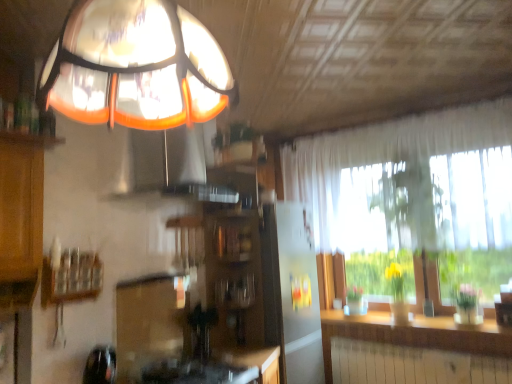
This screenshot has width=512, height=384. What are the coordinates of `wooden shelf at left` in the screenshot? It's located at (71, 277).

The width and height of the screenshot is (512, 384). Describe the element at coordinates (71, 277) in the screenshot. I see `wooden shelf at left` at that location.

Where is `wooden counter top at lower right`? The height and width of the screenshot is (384, 512). wooden counter top at lower right is located at coordinates (417, 333).

In order to face wooden counter top at lower right, should I rotate leftwards or rightwards?

To align with it, rotate right about 19.520°.

In order to face translucent white curtain at right, should I rotate leftwards or rightwards?

To face it directly, rotate right by 16.787 degrees.

This screenshot has height=384, width=512. What do you see at coordinates (383, 153) in the screenshot?
I see `translucent white curtain at right` at bounding box center [383, 153].

Describe the element at coordinates (234, 256) in the screenshot. I see `wooden cabinet at center` at that location.

Find the location of a particular element. This screenshot has width=512, height=384. wooden shelf at left is located at coordinates (71, 277).

In terms of height, does wooden cabinet at center look taller or shorter compared to wooden counter top at lower right?

In the image, wooden cabinet at center appears to be taller than wooden counter top at lower right.

Is wooden cabinet at center situated inside wooden counter top at lower right or outside?

wooden cabinet at center lies outside wooden counter top at lower right.

Would you say wooden cabinet at center is to the left or to the right of wooden counter top at lower right in the picture?

In the image, wooden cabinet at center appears on the left side of wooden counter top at lower right.

Based on the photo, which object is closer to the camera, wooden cabinet at center or wooden counter top at lower right?

wooden cabinet at center is closer to the camera.

In terms of height, does translucent glass lampshade at upper center look taller or shorter compared to orange glass exhaust hood at upper center?

translucent glass lampshade at upper center is shorter than orange glass exhaust hood at upper center.

In the scene shown: Can you tell me how much translucent glass lampshade at upper center and orange glass exhaust hood at upper center differ in facing direction?

85.8 degrees.

Considering the sizes of objects translucent glass lampshade at upper center and orange glass exhaust hood at upper center in the image provided, who is smaller, translucent glass lampshade at upper center or orange glass exhaust hood at upper center?

translucent glass lampshade at upper center.

Between translucent glass lampshade at upper center and orange glass exhaust hood at upper center, which one appears on the right side from the viewer's perspective?

translucent glass lampshade at upper center is more to the right.

What's the angular difference between orange glass exhaust hood at upper center and wooden shelf at left's facing directions?

The angular difference between orange glass exhaust hood at upper center and wooden shelf at left is 4.96 degrees.

Does orange glass exhaust hood at upper center contain wooden shelf at left?

No, wooden shelf at left is not a part of orange glass exhaust hood at upper center.

Which object is thinner, orange glass exhaust hood at upper center or wooden shelf at left?

wooden shelf at left is thinner.

Identify the location of exhaust hood on the right of wooden shelf at left. The image size is (512, 384). (167, 166).

From a real-world perspective, does translucent white curtain at right stand above wooden counter top at lower right?

Indeed, from a real-world perspective, translucent white curtain at right stands above wooden counter top at lower right.

Looking at this image, considering the relative sizes of translucent white curtain at right and wooden counter top at lower right in the image provided, is translucent white curtain at right bigger than wooden counter top at lower right?

Yes, translucent white curtain at right is bigger than wooden counter top at lower right.

Does translucent white curtain at right contain wooden counter top at lower right?

No, wooden counter top at lower right is not surrounded by translucent white curtain at right.

Is the position of translucent white curtain at right more distant than that of wooden counter top at lower right?

No, translucent white curtain at right is closer to the viewer.

Does orange glass exhaust hood at upper center have a lesser width compared to wooden cabinet at center?

Yes.

Does orange glass exhaust hood at upper center have a larger size compared to wooden cabinet at center?

Indeed, orange glass exhaust hood at upper center has a larger size compared to wooden cabinet at center.

Is orange glass exhaust hood at upper center inside or outside of wooden cabinet at center?

orange glass exhaust hood at upper center is located beyond the bounds of wooden cabinet at center.

From the image's perspective, is orange glass exhaust hood at upper center positioned above or below wooden cabinet at center?

From the image's perspective, orange glass exhaust hood at upper center appears above wooden cabinet at center.

How many degrees apart are the facing directions of wooden shelf at left and wooden cabinet at center?

The facing directions of wooden shelf at left and wooden cabinet at center are 1.18 degrees apart.

Which is more distant, (x=90, y=254) or (x=261, y=218)?

The point (x=261, y=218) is more distant.

Which is more to the left, wooden shelf at left or wooden cabinet at center?

Positioned to the left is wooden shelf at left.

Would you say wooden shelf at left contains wooden cabinet at center?

Result: Actually, wooden cabinet at center is outside wooden shelf at left.

In the image, is translucent glass lampshade at upper center positioned in front of or behind wooden counter top at lower right?

translucent glass lampshade at upper center is positioned closer to the viewer than wooden counter top at lower right.

Is translucent glass lampshade at upper center at the right side of wooden counter top at lower right?

No, translucent glass lampshade at upper center is not to the right of wooden counter top at lower right.

From a real-world perspective, is translucent glass lampshade at upper center beneath wooden counter top at lower right?

Incorrect, from a real-world perspective, translucent glass lampshade at upper center is higher than wooden counter top at lower right.

The image size is (512, 384). Identify the location of counter top located underneath the wooden cabinet at center (from a real-world perspective). (417, 333).

Where is `exhaust hood above the translucent glass lampshade at upper center (from a real-world perspective)`? The height and width of the screenshot is (384, 512). exhaust hood above the translucent glass lampshade at upper center (from a real-world perspective) is located at coordinates (167, 166).

Based on their spatial positions, is orange glass exhaust hood at upper center or wooden shelf at left closer to translucent glass lampshade at upper center?

The object closer to translucent glass lampshade at upper center is wooden shelf at left.

Which object lies nearer to the anchor point wooden counter top at lower right, translucent glass lampshade at upper center or wooden cabinet at center?

The object closer to wooden counter top at lower right is wooden cabinet at center.

Which object lies nearer to the anchor point orange glass exhaust hood at upper center, translucent white curtain at right or wooden cabinet at center?

wooden cabinet at center is positioned closer to the anchor orange glass exhaust hood at upper center.

Looking at the image, which one is located further to wooden cabinet at center, translucent glass lampshade at upper center or orange glass exhaust hood at upper center?

The object further to wooden cabinet at center is translucent glass lampshade at upper center.

Estimate the real-world distances between objects in this image. Which object is further from orange glass exhaust hood at upper center, translucent glass lampshade at upper center or wooden shelf at left?

Among the two, translucent glass lampshade at upper center is located further to orange glass exhaust hood at upper center.

From the image, which object appears to be nearer to wooden shelf at left, translucent glass lampshade at upper center or wooden counter top at lower right?

Among the two, translucent glass lampshade at upper center is located nearer to wooden shelf at left.

Which object lies nearer to the anchor point wooden shelf at left, wooden cabinet at center or translucent glass lampshade at upper center?

Based on the image, wooden cabinet at center appears to be nearer to wooden shelf at left.

Based on their spatial positions, is wooden shelf at left or wooden counter top at lower right closer to wooden cabinet at center?

Based on the image, wooden shelf at left appears to be nearer to wooden cabinet at center.

Where is `window between wooden shelf at left and wooden counter top at lower right in the horizontal direction`? The width and height of the screenshot is (512, 384). window between wooden shelf at left and wooden counter top at lower right in the horizontal direction is located at coordinates (383, 153).

Where is `shelf between orange glass exhaust hood at upper center and wooden cabinet at center from top to bottom`? The height and width of the screenshot is (384, 512). shelf between orange glass exhaust hood at upper center and wooden cabinet at center from top to bottom is located at coordinates (71, 277).

The width and height of the screenshot is (512, 384). I want to click on exhaust hood between translucent glass lampshade at upper center and translucent white curtain at right from front to back, so click(x=167, y=166).

This screenshot has height=384, width=512. Find the location of `window between translucent glass lampshade at upper center and wooden counter top at lower right in the front-back direction`. window between translucent glass lampshade at upper center and wooden counter top at lower right in the front-back direction is located at coordinates (383, 153).